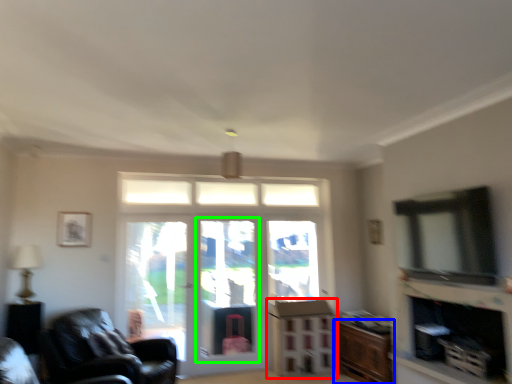
Question: Based on their relative distances, which object is farther from dresser (highlighted by a red box)? Choose from cabinetry (highlighted by a blue box) and screen door (highlighted by a green box).

Choices:
 (A) cabinetry
 (B) screen door

Answer: (B)